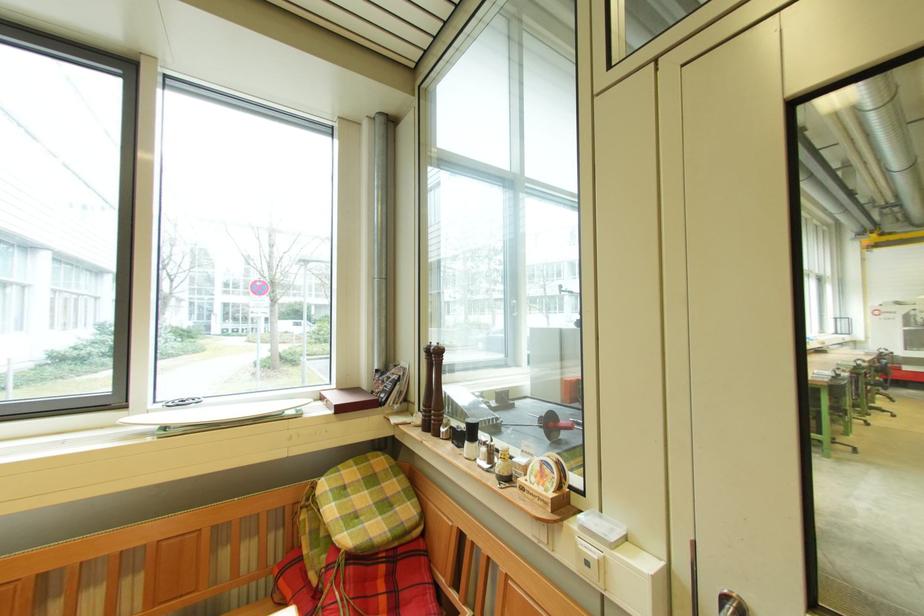
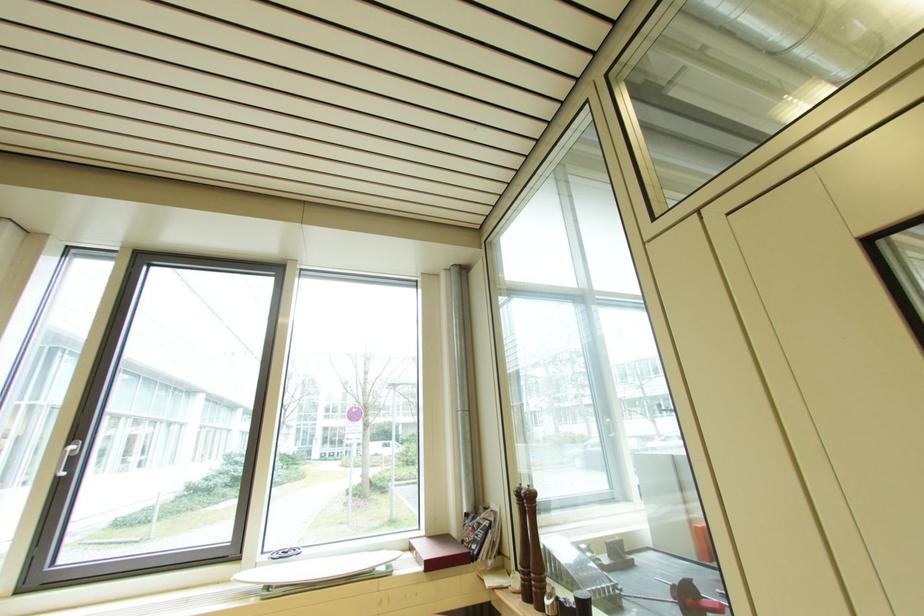
Question: Based on the continuous images, in which direction is the camera rotating? Reply with the corresponding letter.

Choices:
 (A) Left
 (B) Right
 (C) Up
 (D) Down

Answer: (C)